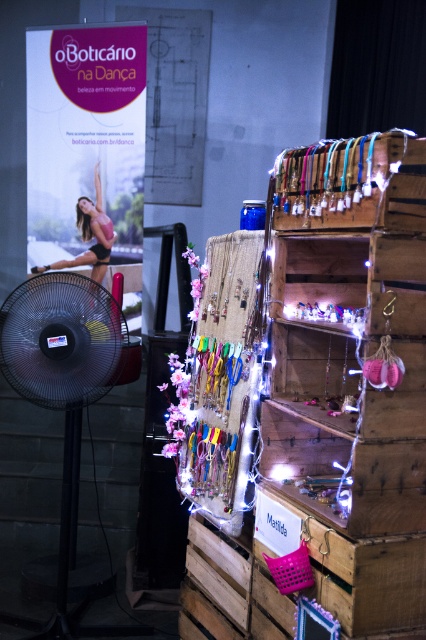
You are an event organizer who needs to adjust the display. You want to move the matte black bikini at center closer to the black plastic mechanical fan at left by 10 inches. Is this possible without moving the fan?

The black plastic mechanical mechanical fan at left is 35.04 inches from the matte black bikini at center. Moving the bikini 10 inches closer would require a new distance of 25.04 inches between them. Since the fan cannot be moved, this adjustment is possible as long as there is enough space on the shelf to reposition the bikini without obstruction.

You are at an exhibition and want to take a photo of the matte black bikini at center without the black plastic mechanical fan at left appearing in the frame. Is it possible to position yourself in a way that the fan is out of the shot while still capturing the bikini?

The black plastic mechanical fan at left is positioned on the right side of matte black bikini at center. Therefore, you can position yourself to the right of the bikini so the fan is out of the frame while still capturing the matte black bikini at center.

Consider the image. You are an event organizer checking the display setup. You need to ensure that the fan doesn not block the banner behind it. Given the sizes of the black plastic mechanical fan at left and the matte black bikini at center, which object is larger and might be more likely to obstruct the banner?

The black plastic mechanical fan at left is bigger than the matte black bikini at center, so it is more likely to obstruct the banner.